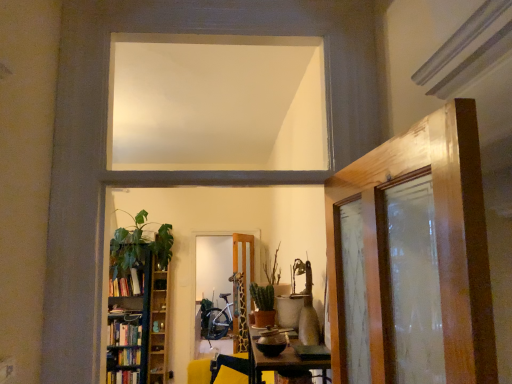
Question: Is green matte plant at center, the 2th plant viewed from the front, in front of or behind hardcover books at left in the image?

Choices:
 (A) front
 (B) behind

Answer: (A)

Question: Is point (261, 292) positioned closer to the camera than point (135, 291)?

Choices:
 (A) closer
 (B) farther

Answer: (A)

Question: Which is nearer to the green matte cactus at center, the 2th plant in the back-to-front sequence?

Choices:
 (A) white matte window at upper center
 (B) green matte plant at center, the 2th plant viewed from the front
 (C) yellow fabric swivel chair at center
 (D) wooden bookshelf at left
 (E) hardcover books at left

Answer: (B)

Question: Which of these objects is positioned farthest from the wooden shelf at left?

Choices:
 (A) yellow fabric swivel chair at center
 (B) green matte cactus at center, which is counted as the 1th plant, starting from the front
 (C) wooden bookshelf at left
 (D) green leafy plant at left
 (E) hardcover books at left

Answer: (B)